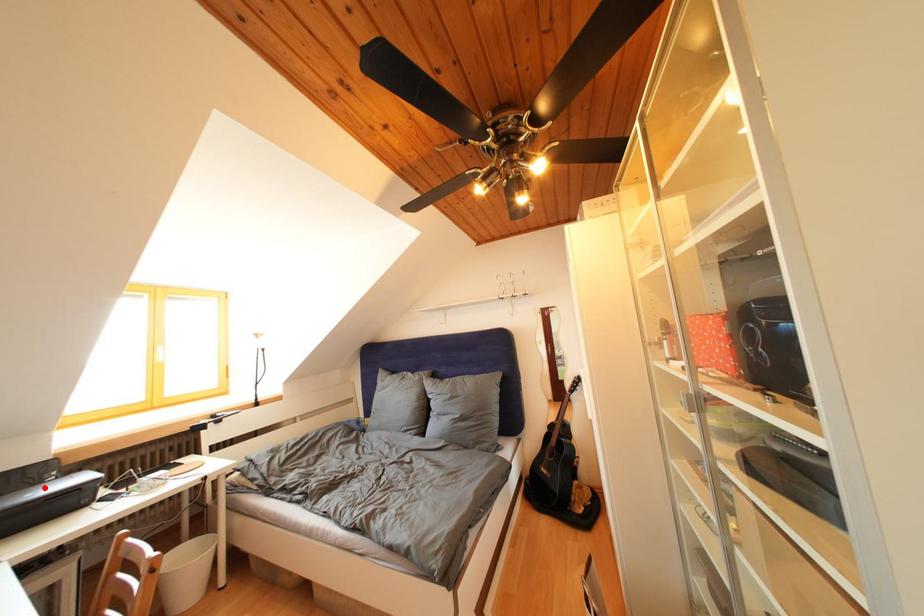
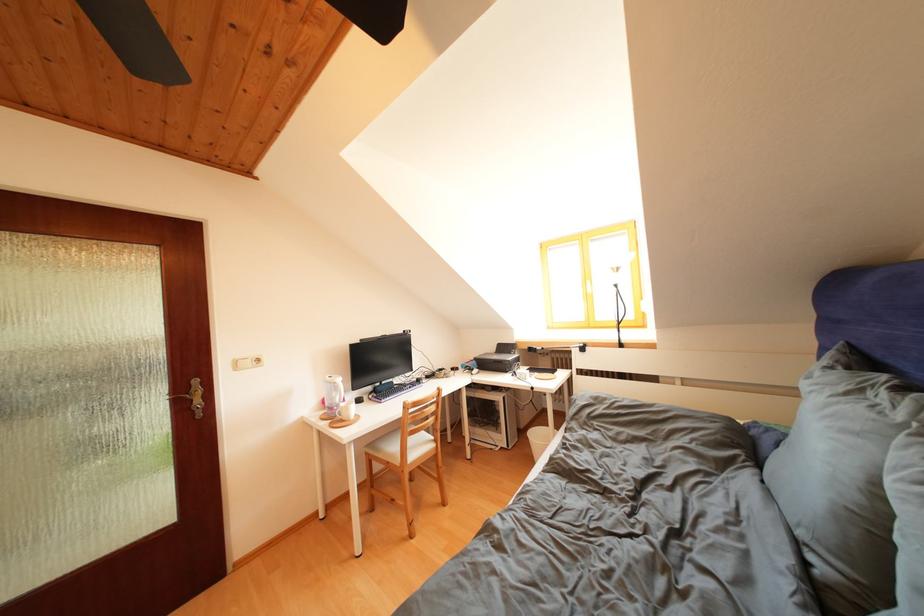
Question: I am providing you with two images of the same scene from different viewpoints. A red point is shown in image1. For the corresponding object point in image2, is it positioned nearer or farther from the camera?

Choices:
 (A) Nearer
 (B) Farther

Answer: (B)